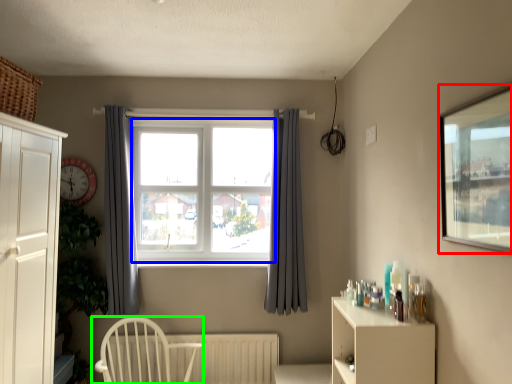
Question: Which is farther away from window screen (highlighted by a red box)? bay window (highlighted by a blue box) or chair (highlighted by a green box)?

Choices:
 (A) bay window
 (B) chair

Answer: (B)